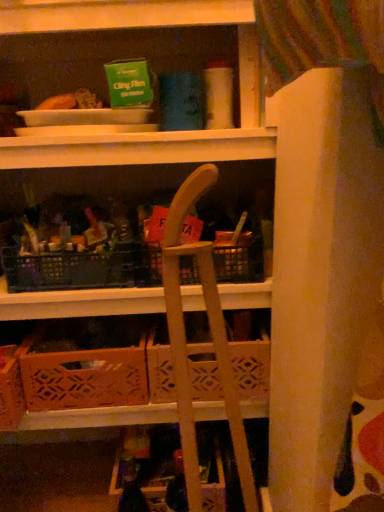
Question: Are wooden folding chair at center and wooden crate at center far apart?

Choices:
 (A) yes
 (B) no

Answer: (B)

Question: Does wooden folding chair at center contain wooden crate at center?

Choices:
 (A) yes
 (B) no

Answer: (B)

Question: From a real-world perspective, is wooden folding chair at center below wooden crate at center?

Choices:
 (A) yes
 (B) no

Answer: (B)

Question: Does wooden folding chair at center have a lesser width compared to wooden crate at center?

Choices:
 (A) yes
 (B) no

Answer: (A)

Question: Is wooden crate at center at the back of wooden folding chair at center?

Choices:
 (A) no
 (B) yes

Answer: (A)

Question: Is wooden folding chair at center bigger or smaller than wooden crate at center?

Choices:
 (A) small
 (B) big

Answer: (B)

Question: Considering the positions of point (183, 446) and point (235, 382), is point (183, 446) closer or farther from the camera than point (235, 382)?

Choices:
 (A) farther
 (B) closer

Answer: (B)

Question: Looking at their shapes, would you say wooden folding chair at center is wider or thinner than wooden crate at center?

Choices:
 (A) thin
 (B) wide

Answer: (A)

Question: Do you think wooden folding chair at center is within wooden crate at center, or outside of it?

Choices:
 (A) outside
 (B) inside

Answer: (A)

Question: In terms of size, does wooden folding chair at center appear bigger or smaller than wooden crate at lower center?

Choices:
 (A) small
 (B) big

Answer: (B)

Question: In terms of width, does wooden folding chair at center look wider or thinner when compared to wooden crate at lower center?

Choices:
 (A) thin
 (B) wide

Answer: (A)

Question: In terms of height, does wooden folding chair at center look taller or shorter compared to wooden crate at lower center?

Choices:
 (A) short
 (B) tall

Answer: (B)

Question: From the image's perspective, is wooden folding chair at center positioned above or below wooden crate at lower center?

Choices:
 (A) below
 (B) above

Answer: (A)

Question: Looking at their shapes, would you say wooden crate at lower center is wider or thinner than wooden crate at center?

Choices:
 (A) wide
 (B) thin

Answer: (A)

Question: Is wooden crate at lower center bigger or smaller than wooden crate at center?

Choices:
 (A) big
 (B) small

Answer: (B)